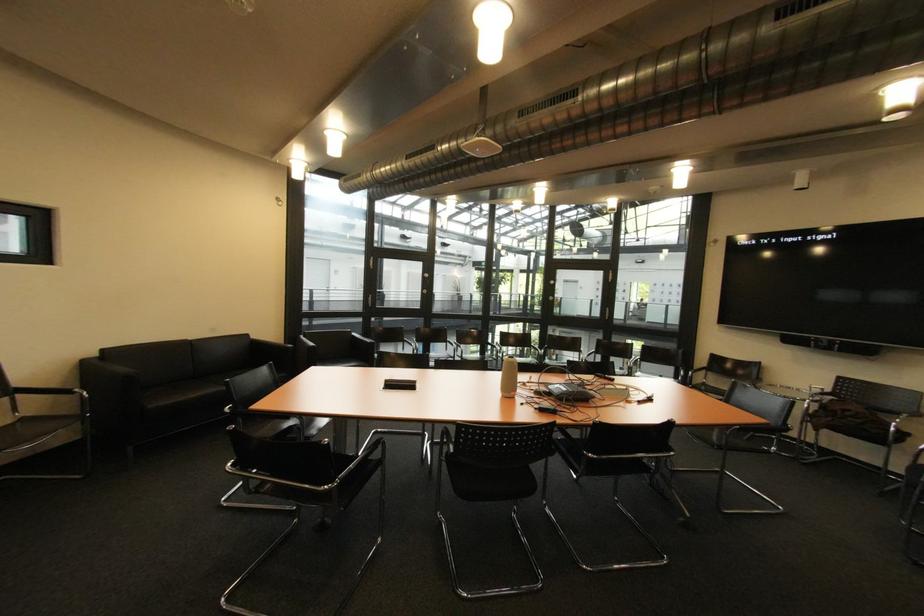
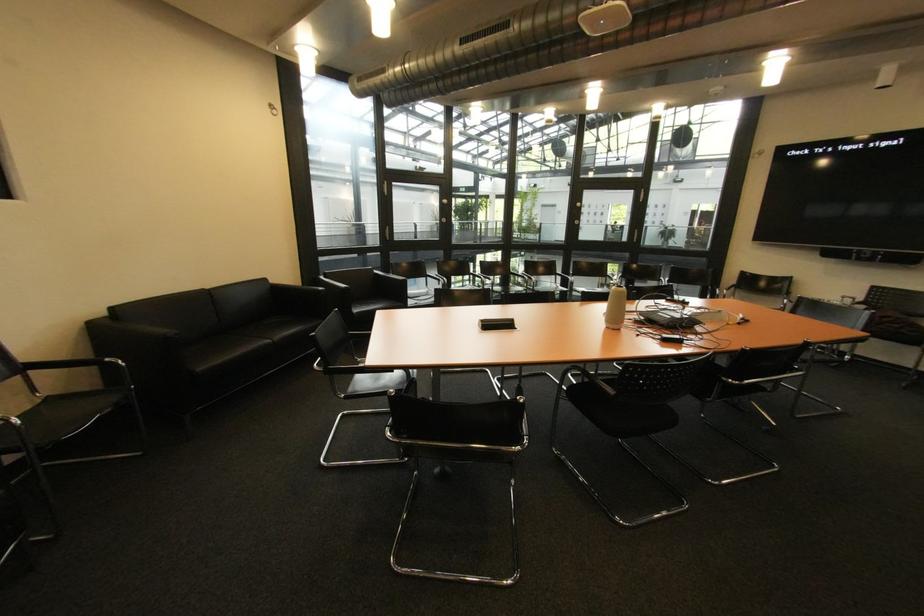
Question: The first image is from the beginning of the video and the second image is from the end. How did the camera likely rotate when shooting the video?

Choices:
 (A) Left
 (B) Right
 (C) Up
 (D) Down

Answer: (D)